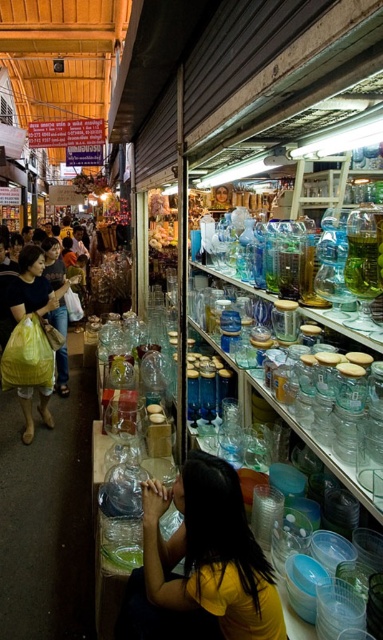
You are a customer in the market and want to pick up the yellow plastic bag at left and the yellow matte shirt at center. Which item should you reach for first if you want to grab the one closer to you?

The yellow matte shirt at center is closer to the viewer than the yellow plastic bag at left, so you should reach for the yellow matte shirt at center first.